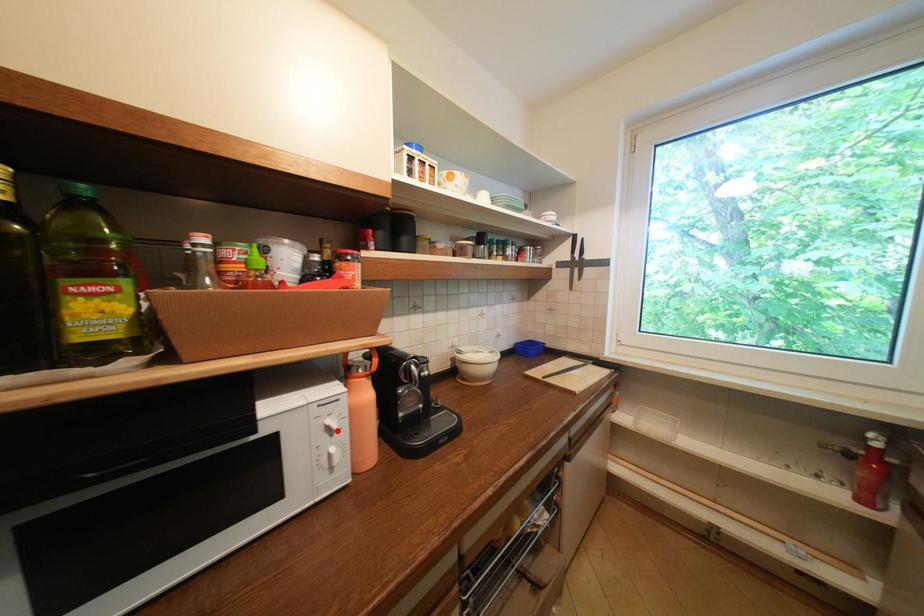
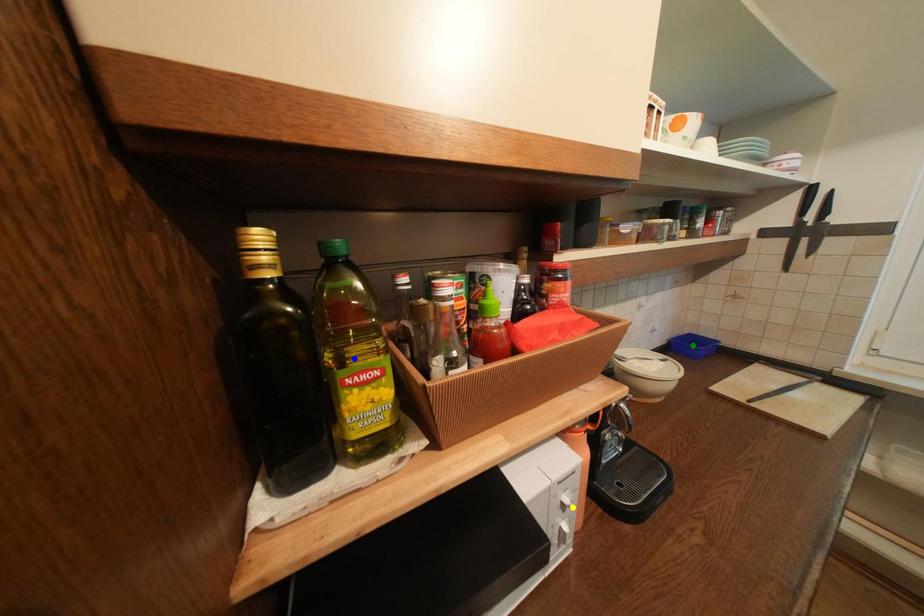
Question: I am providing you with two images of the same scene from different viewpoints. A red point is marked on the first image. You are given multiple points on the second image. In image 2, which mark is for the same physical point as the one in image 1?

Choices:
 (A) yellow point
 (B) green point
 (C) blue point

Answer: (A)